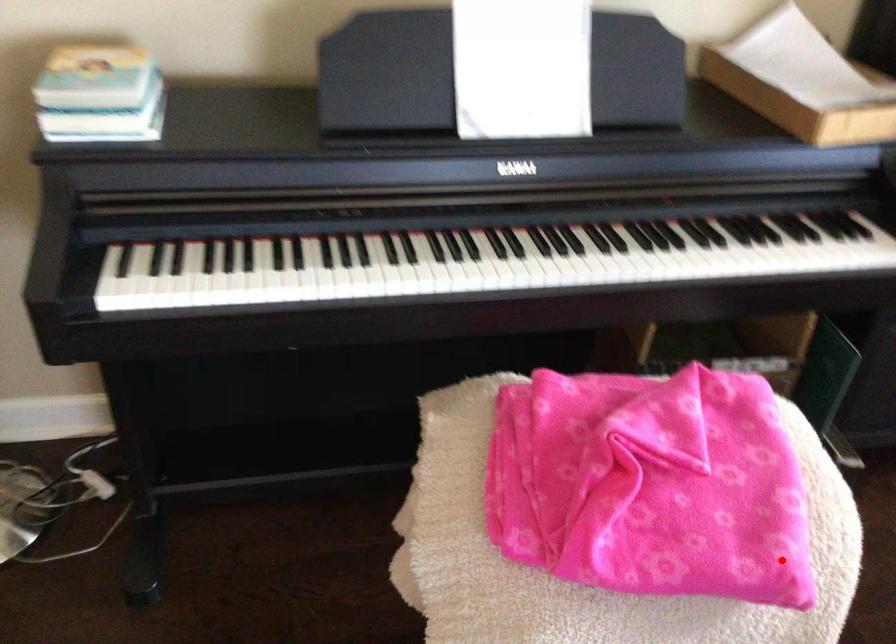
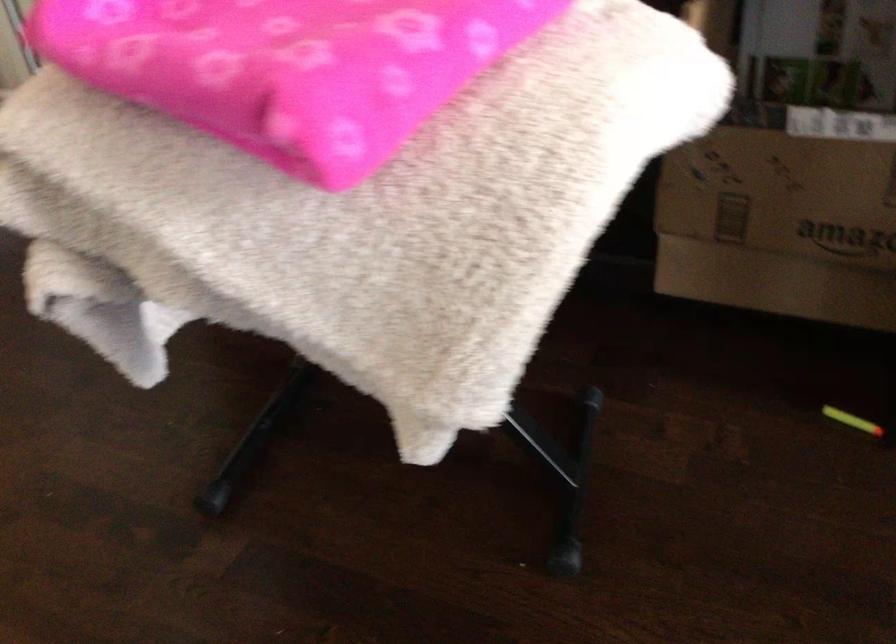
Locate, in the second image, the point that corresponds to the highlighted location in the first image.

(288, 67)